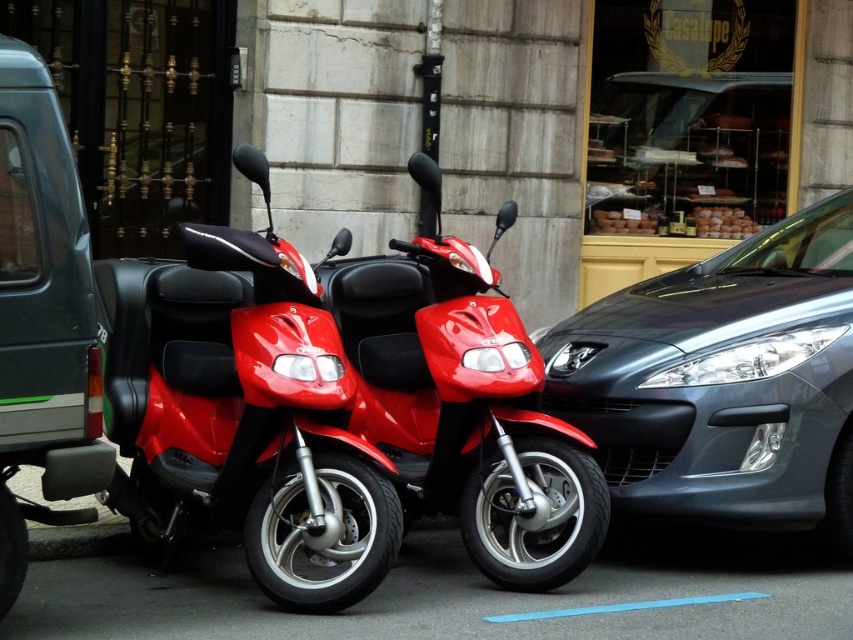
Question: Which point is closer to the camera?

Choices:
 (A) glossy red scooter at center
 (B) matte red scooter at center
 (C) matte gray minivan at left

Answer: (C)

Question: Which is farther from the matte gray minivan at left?

Choices:
 (A) matte red scooter at center
 (B) glossy red scooter at center

Answer: (B)

Question: Is matte red scooter at center thinner than glossy red scooter at center?

Choices:
 (A) yes
 (B) no

Answer: (B)

Question: Does matte red scooter at center appear under matte gray minivan at left?

Choices:
 (A) yes
 (B) no

Answer: (A)

Question: Is matte red scooter at center smaller than glossy red scooter at center?

Choices:
 (A) no
 (B) yes

Answer: (A)

Question: Which point is closer to the camera?

Choices:
 (A) (476, 285)
 (B) (839, 280)

Answer: (A)